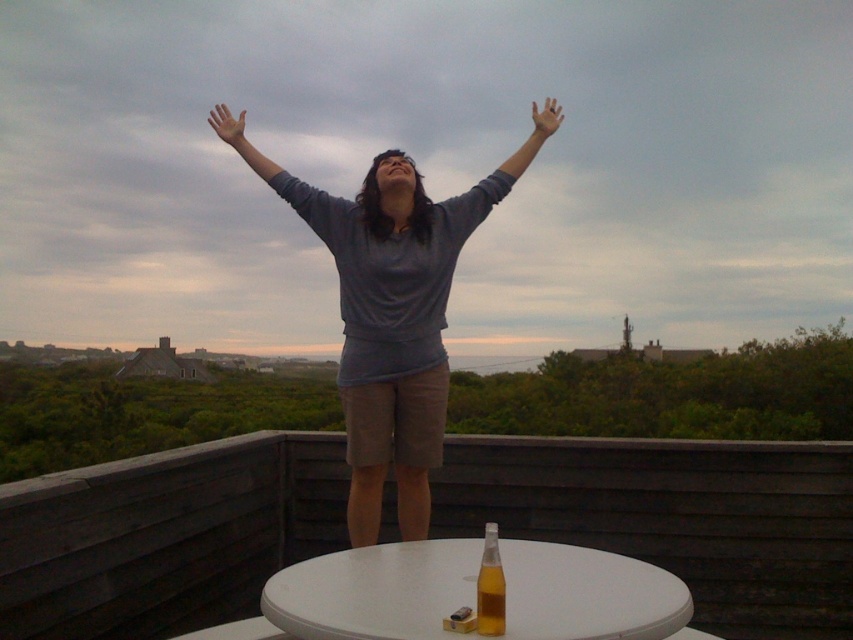
You are a photographer trying to capture the scene. You notice the gray matte arm at upper center and the translucent glass bottle at center. Which object is closer to the camera lens?

The gray matte arm at upper center is closer to the camera lens because it is in front of the translucent glass bottle at center.

You are a photographer trying to capture the exact position of the gray matte arm at upper center and the matte skin hand at upper center in the image. Which object is positioned more to the right?

The matte skin hand at upper center is positioned more to the right than the gray matte arm at upper center.